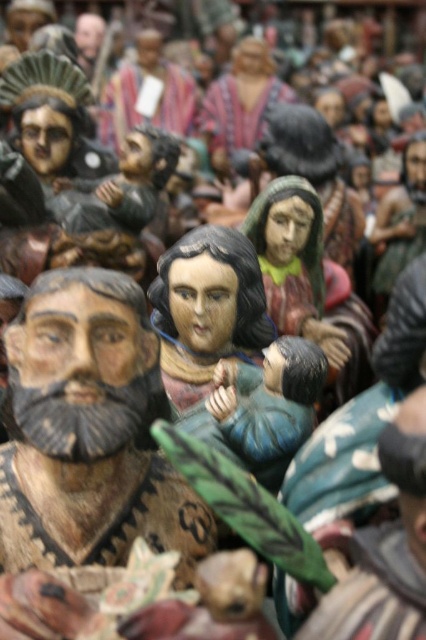
You are an art restorer examining the wooden statue at center and the wooden figure at center. Which one is closer to you in the scene?

The wooden statue at center is closer to you than the wooden figure at center because it is further to the viewer.

You are standing at point (x=244, y=240) and want to reach the entrance of the building which is at point 0.5, 0.6. The path between them is 8.06 meters long. Can you walk this distance?

Yes, you can walk the 8.06 meters between point (x=244, y=240) and the entrance at 0.5, 0.6 since it is a manageable distance for walking.